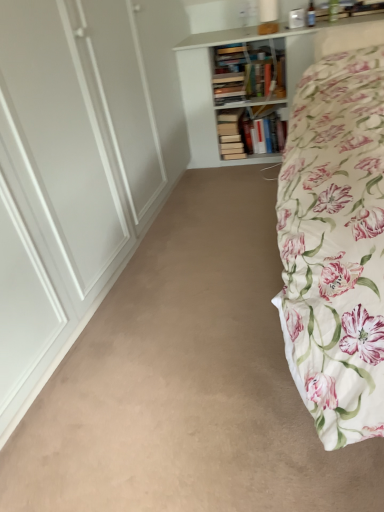
Question: Considering the relative sizes of floral cotton bed at right and white wooden bookcase at upper center in the image provided, is floral cotton bed at right taller than white wooden bookcase at upper center?

Choices:
 (A) no
 (B) yes

Answer: (A)

Question: Is floral cotton bed at right located outside white wooden bookcase at upper center?

Choices:
 (A) no
 (B) yes

Answer: (B)

Question: Can you confirm if floral cotton bed at right is shorter than white wooden bookcase at upper center?

Choices:
 (A) no
 (B) yes

Answer: (B)

Question: Could white wooden bookcase at upper center be considered to be inside floral cotton bed at right?

Choices:
 (A) yes
 (B) no

Answer: (B)

Question: Considering the relative sizes of floral cotton bed at right and white wooden bookcase at upper center in the image provided, is floral cotton bed at right bigger than white wooden bookcase at upper center?

Choices:
 (A) no
 (B) yes

Answer: (B)

Question: Is floral cotton bed at right facing towards white wooden bookcase at upper center?

Choices:
 (A) no
 (B) yes

Answer: (A)

Question: Does beige carpet at center have a greater height compared to floral cotton bed at right?

Choices:
 (A) yes
 (B) no

Answer: (B)

Question: From a real-world perspective, is beige carpet at center under floral cotton bed at right?

Choices:
 (A) yes
 (B) no

Answer: (A)

Question: Considering the relative positions of beige carpet at center and floral cotton bed at right in the image provided, is beige carpet at center to the right of floral cotton bed at right from the viewer's perspective?

Choices:
 (A) yes
 (B) no

Answer: (B)

Question: Is beige carpet at center thinner than floral cotton bed at right?

Choices:
 (A) yes
 (B) no

Answer: (A)

Question: Is floral cotton bed at right at the back of beige carpet at center?

Choices:
 (A) yes
 (B) no

Answer: (B)

Question: Is beige carpet at center placed right next to floral cotton bed at right?

Choices:
 (A) yes
 (B) no

Answer: (B)

Question: From the image's perspective, is beige carpet at center over white wooden bookcase at upper center?

Choices:
 (A) yes
 (B) no

Answer: (B)